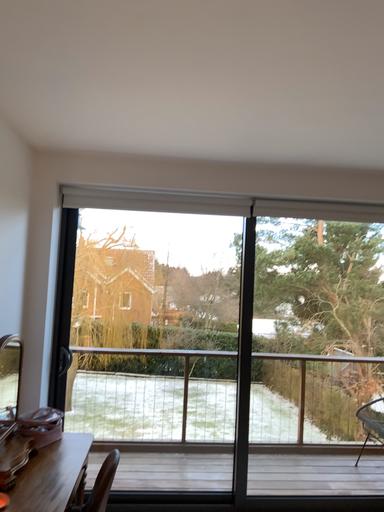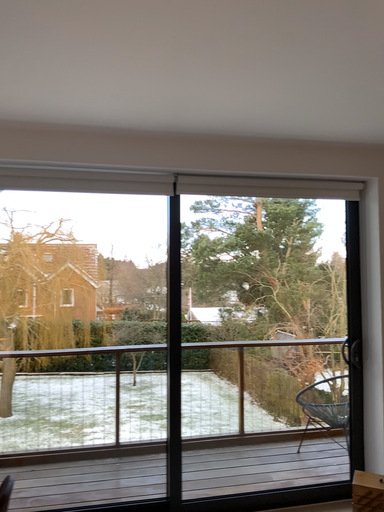
Question: How did the camera likely rotate when shooting the video?

Choices:
 (A) rotated right
 (B) rotated left

Answer: (A)